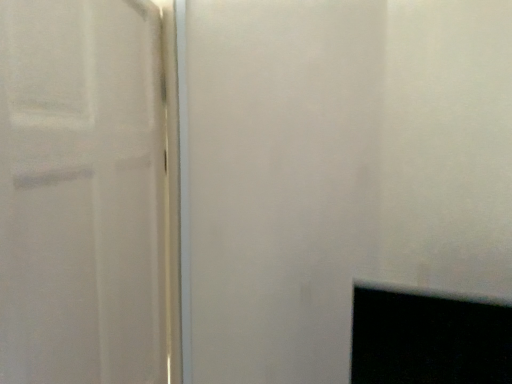
Locate an element on the screen. The image size is (512, 384). white matte door at left is located at coordinates (85, 194).

What do you see at coordinates (85, 194) in the screenshot? This screenshot has height=384, width=512. I see `white matte door at left` at bounding box center [85, 194].

The height and width of the screenshot is (384, 512). What are the coordinates of `white matte door at left` in the screenshot? It's located at (85, 194).